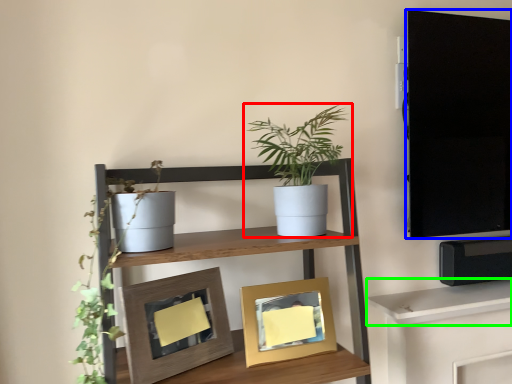
Question: Based on their relative distances, which object is nearer to houseplant (highlighted by a red box)? Choose from tv cabinet (highlighted by a blue box) and shelf (highlighted by a green box).

Choices:
 (A) tv cabinet
 (B) shelf

Answer: (A)